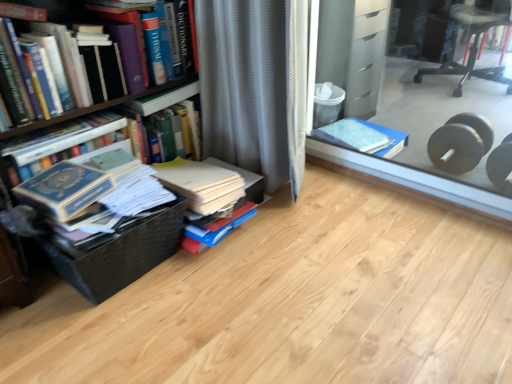
You are a GUI agent. You are given a task and a screenshot of the screen. Output one action in this format:
    pyautogui.click(x=<x>, y=<y>)
    Task: Click on the empty space that is ontop of black woven basket at lower left (from a real-world perspective)
    This screenshot has width=512, height=384.
    Given the screenshot: What is the action you would take?
    pyautogui.click(x=111, y=212)